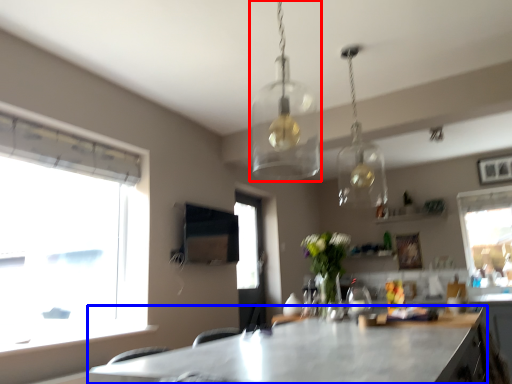
Question: Which object appears closest to the camera in this image, lamp (highlighted by a red box) or table (highlighted by a blue box)?

Choices:
 (A) lamp
 (B) table

Answer: (B)